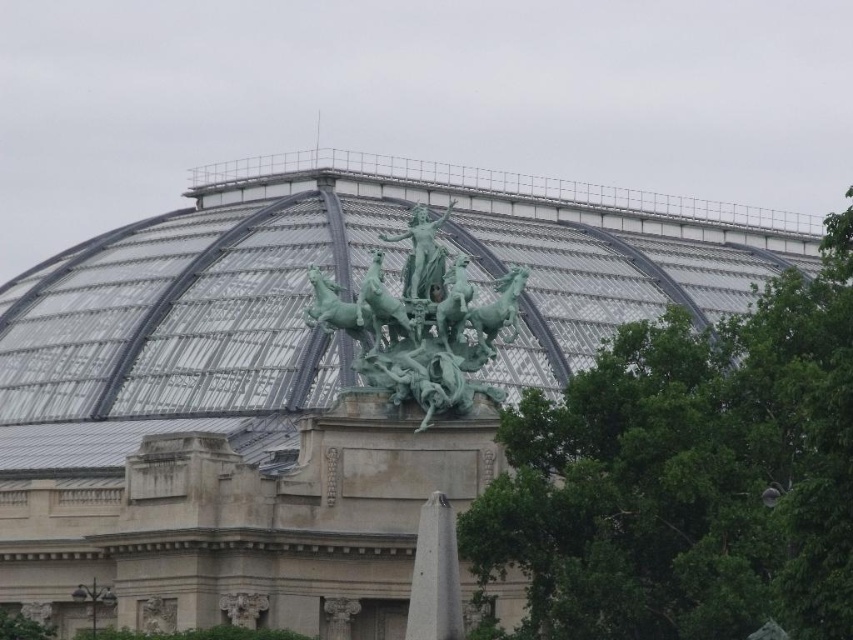
Which is more to the left, green leafy tree at upper right or green polished stone statue at center?

Positioned to the left is green polished stone statue at center.

Does green leafy tree at upper right come behind green polished stone statue at center?

No, it is in front of green polished stone statue at center.

Is point (651, 412) closer to camera compared to point (422, 248)?

That is True.

Where is `green leafy tree at upper right`? This screenshot has height=640, width=853. green leafy tree at upper right is located at coordinates (688, 476).

Is green leafy tree at upper right to the left of green patina statue at center from the viewer's perspective?

In fact, green leafy tree at upper right is to the right of green patina statue at center.

Is point (840, 346) positioned in front of point (392, 400)?

Yes, point (840, 346) is in front of point (392, 400).

This screenshot has width=853, height=640. What are the coordinates of `green leafy tree at upper right` in the screenshot? It's located at (688, 476).

Does point (383, 352) come closer to viewer compared to point (381, 236)?

Yes, point (383, 352) is closer to viewer.

Does green patina statue at center come in front of green polished stone statue at center?

Yes, green patina statue at center is in front of green polished stone statue at center.

Locate an element on the screen. green patina statue at center is located at coordinates (421, 323).